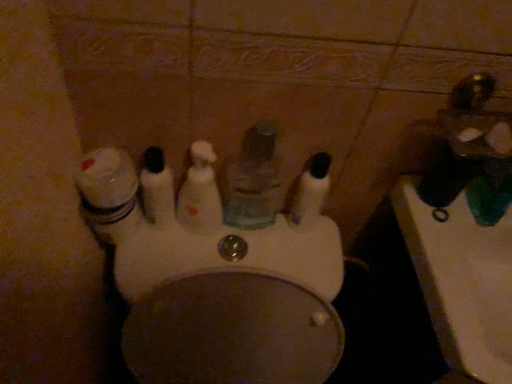
Question: Considering the relative sizes of white glossy toilet at center and translucent plastic mouthwash at center, the 1th mouthwash in the right-to-left sequence, in the image provided, is white glossy toilet at center thinner than translucent plastic mouthwash at center, the 1th mouthwash in the right-to-left sequence,?

Choices:
 (A) no
 (B) yes

Answer: (A)

Question: Is white glossy toilet at center positioned far away from translucent plastic mouthwash at center, the 1th mouthwash in the right-to-left sequence?

Choices:
 (A) no
 (B) yes

Answer: (A)

Question: Can you confirm if white glossy toilet at center is positioned to the right of translucent plastic mouthwash at center, the 1th mouthwash in the right-to-left sequence?

Choices:
 (A) yes
 (B) no

Answer: (B)

Question: Is white glossy toilet at center positioned with its back to translucent plastic mouthwash at center, the 1th mouthwash in the right-to-left sequence?

Choices:
 (A) yes
 (B) no

Answer: (A)

Question: Considering the relative sizes of white glossy toilet at center and translucent plastic mouthwash at center, the 1th mouthwash in the right-to-left sequence, in the image provided, is white glossy toilet at center bigger than translucent plastic mouthwash at center, the 1th mouthwash in the right-to-left sequence,?

Choices:
 (A) yes
 (B) no

Answer: (A)

Question: Visually, is white glossy jar at left positioned to the left or to the right of translucent plastic mouthwash at center, marked as the 1th mouthwash in a left-to-right arrangement?

Choices:
 (A) left
 (B) right

Answer: (A)

Question: From a real-world perspective, is white glossy jar at left above or below translucent plastic mouthwash at center, which ranks as the fourth mouthwash in right-to-left order?

Choices:
 (A) above
 (B) below

Answer: (A)

Question: From the image's perspective, relative to translucent plastic mouthwash at center, which ranks as the fourth mouthwash in right-to-left order, is white glossy jar at left above or below?

Choices:
 (A) below
 (B) above

Answer: (A)

Question: Considering the positions of white glossy jar at left and translucent plastic mouthwash at center, marked as the 1th mouthwash in a left-to-right arrangement, in the image, is white glossy jar at left bigger or smaller than translucent plastic mouthwash at center, marked as the 1th mouthwash in a left-to-right arrangement,?

Choices:
 (A) small
 (B) big

Answer: (B)

Question: From the image's perspective, is gold metallic faucet at upper right above or below translucent plastic mouthwash at center, which is counted as the third mouthwash, starting from the left?

Choices:
 (A) above
 (B) below

Answer: (A)

Question: In the image, is gold metallic faucet at upper right positioned in front of or behind translucent plastic mouthwash at center, which is counted as the third mouthwash, starting from the left?

Choices:
 (A) behind
 (B) front

Answer: (B)

Question: Looking at their shapes, would you say gold metallic faucet at upper right is wider or thinner than translucent plastic mouthwash at center, which is counted as the third mouthwash, starting from the left?

Choices:
 (A) thin
 (B) wide

Answer: (B)

Question: From a real-world perspective, is gold metallic faucet at upper right above or below translucent plastic mouthwash at center, which appears as the 2th mouthwash when viewed from the right?

Choices:
 (A) below
 (B) above

Answer: (B)

Question: In the image, is white glossy jar at left on the left side or the right side of translucent plastic mouthwash at center, which appears as the 2th mouthwash when viewed from the right?

Choices:
 (A) left
 (B) right

Answer: (A)

Question: Looking at their shapes, would you say white glossy jar at left is wider or thinner than translucent plastic mouthwash at center, which is counted as the third mouthwash, starting from the left?

Choices:
 (A) wide
 (B) thin

Answer: (A)